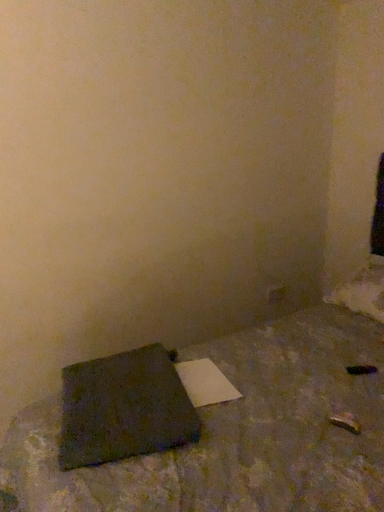
Question: Which is correct: dark gray fabric notebook at lower left is inside dark gray fabric cushion at lower left, or outside of it?

Choices:
 (A) outside
 (B) inside

Answer: (B)

Question: Looking at the image, does dark gray fabric notebook at lower left seem bigger or smaller compared to dark gray fabric cushion at lower left?

Choices:
 (A) big
 (B) small

Answer: (B)

Question: Relative to dark gray fabric cushion at lower left, is dark gray fabric notebook at lower left in front or behind?

Choices:
 (A) front
 (B) behind

Answer: (B)

Question: Relative to dark gray fabric notebook at lower left, is dark gray fabric cushion at lower left in front or behind?

Choices:
 (A) front
 (B) behind

Answer: (A)

Question: Considering the positions of point (372, 387) and point (180, 419), is point (372, 387) closer or farther from the camera than point (180, 419)?

Choices:
 (A) farther
 (B) closer

Answer: (A)

Question: From the image's perspective, is dark gray fabric cushion at lower left above or below dark gray fabric notebook at lower left?

Choices:
 (A) above
 (B) below

Answer: (A)

Question: In terms of height, does dark gray fabric cushion at lower left look taller or shorter compared to dark gray fabric notebook at lower left?

Choices:
 (A) tall
 (B) short

Answer: (A)